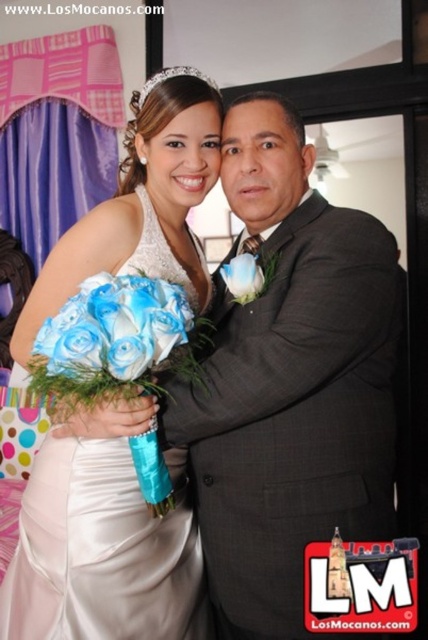
Which is behind, point (113, 364) or point (180, 74)?

The point (180, 74) is behind.

Based on the photo, does blue silk roses at center appear over clear crystal tiara at upper center?

Incorrect, blue silk roses at center is not positioned above clear crystal tiara at upper center.

Where is `blue silk roses at center`? The height and width of the screenshot is (640, 428). blue silk roses at center is located at coordinates (115, 326).

Does gray textured suit at center appear over blue silk roses at center?

No.

Which is more to the left, gray textured suit at center or blue silk roses at center?

Positioned to the left is blue silk roses at center.

Who is more distant from viewer, [309,401] or [92,368]?

The point [309,401] is more distant.

Locate an element on the screen. The width and height of the screenshot is (428, 640). gray textured suit at center is located at coordinates (291, 381).

Looking at this image, which of these two, satin white dress at center or blue silk flower at center, stands taller?

satin white dress at center

At what (x,y) coordinates should I click in order to perform the action: click on satin white dress at center. Please return your answer as a coordinate pair (x, y). The width and height of the screenshot is (428, 640). Looking at the image, I should click on (100, 554).